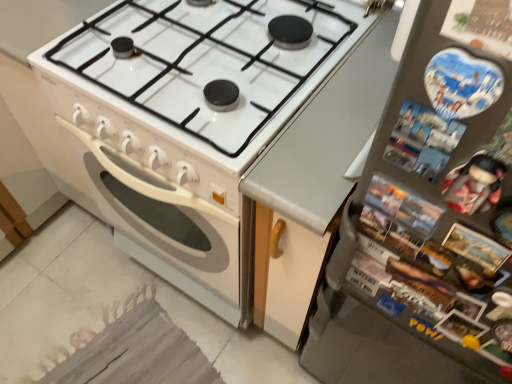
Question: Is white glossy stove at center spatially inside metallic gray refrigerator at right, or outside of it?

Choices:
 (A) outside
 (B) inside

Answer: (A)

Question: From the image's perspective, relative to metallic gray refrigerator at right, is white glossy stove at center above or below?

Choices:
 (A) below
 (B) above

Answer: (B)

Question: From a real-world perspective, is white glossy stove at center physically located above or below metallic gray refrigerator at right?

Choices:
 (A) above
 (B) below

Answer: (B)

Question: From the image's perspective, is metallic gray refrigerator at right above or below white glossy stove at center?

Choices:
 (A) above
 (B) below

Answer: (B)

Question: Would you say metallic gray refrigerator at right is inside or outside white glossy stove at center?

Choices:
 (A) outside
 (B) inside

Answer: (A)

Question: Is point (445, 23) closer or farther from the camera than point (154, 140)?

Choices:
 (A) farther
 (B) closer

Answer: (B)

Question: Is metallic gray refrigerator at right in front of or behind white glossy stove at center in the image?

Choices:
 (A) behind
 (B) front

Answer: (B)